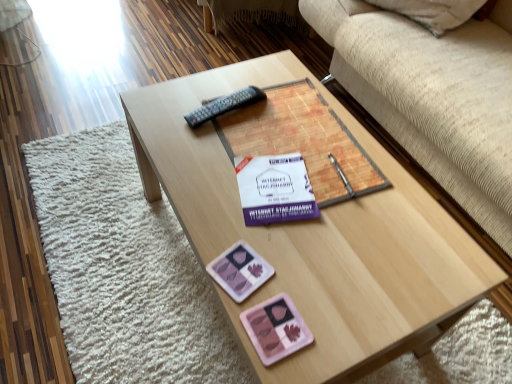
Question: Should I look upward or downward to see matte paper book at center?

Choices:
 (A) down
 (B) up

Answer: (B)

Question: Is there a large distance between pink plastic at lower center, which appears as the 1th currency when viewed from the top, and beige fabric studio couch at upper right?

Choices:
 (A) no
 (B) yes

Answer: (A)

Question: From the image's perspective, is pink plastic at lower center, which is the second currency in bottom-to-top order, beneath beige fabric studio couch at upper right?

Choices:
 (A) no
 (B) yes

Answer: (B)

Question: Is pink plastic at lower center, which is the second currency in bottom-to-top order, to the left of beige fabric studio couch at upper right from the viewer's perspective?

Choices:
 (A) yes
 (B) no

Answer: (A)

Question: Does pink plastic at lower center, which is the second currency in bottom-to-top order, have a greater height compared to beige fabric studio couch at upper right?

Choices:
 (A) yes
 (B) no

Answer: (B)

Question: Can we say pink plastic at lower center, which is the second currency in bottom-to-top order, lies outside beige fabric studio couch at upper right?

Choices:
 (A) no
 (B) yes

Answer: (B)

Question: Is pink plastic at lower center, which appears as the 1th currency when viewed from the top, positioned in front of beige fabric studio couch at upper right?

Choices:
 (A) no
 (B) yes

Answer: (A)

Question: Is beige fabric studio couch at upper right oriented away from pink plastic at lower center, which appears as the 1th currency when viewed from the top?

Choices:
 (A) yes
 (B) no

Answer: (B)

Question: Is beige fabric studio couch at upper right at the left side of pink plastic at lower center, which appears as the 1th currency when viewed from the top?

Choices:
 (A) no
 (B) yes

Answer: (A)

Question: Is beige fabric studio couch at upper right aimed at pink plastic at lower center, which is the second currency in bottom-to-top order?

Choices:
 (A) no
 (B) yes

Answer: (B)

Question: Can pink plastic at lower center, which appears as the 1th currency when viewed from the top, be found inside beige fabric studio couch at upper right?

Choices:
 (A) no
 (B) yes

Answer: (A)

Question: Does beige fabric studio couch at upper right have a greater width compared to pink plastic at lower center, which appears as the 1th currency when viewed from the top?

Choices:
 (A) yes
 (B) no

Answer: (A)

Question: From a real-world perspective, is beige fabric studio couch at upper right positioned under pink plastic at lower center, which is the second currency in bottom-to-top order, based on gravity?

Choices:
 (A) no
 (B) yes

Answer: (B)

Question: Is black plastic remote at center next to pink plastic at lower center, which is the second currency in bottom-to-top order?

Choices:
 (A) no
 (B) yes

Answer: (A)